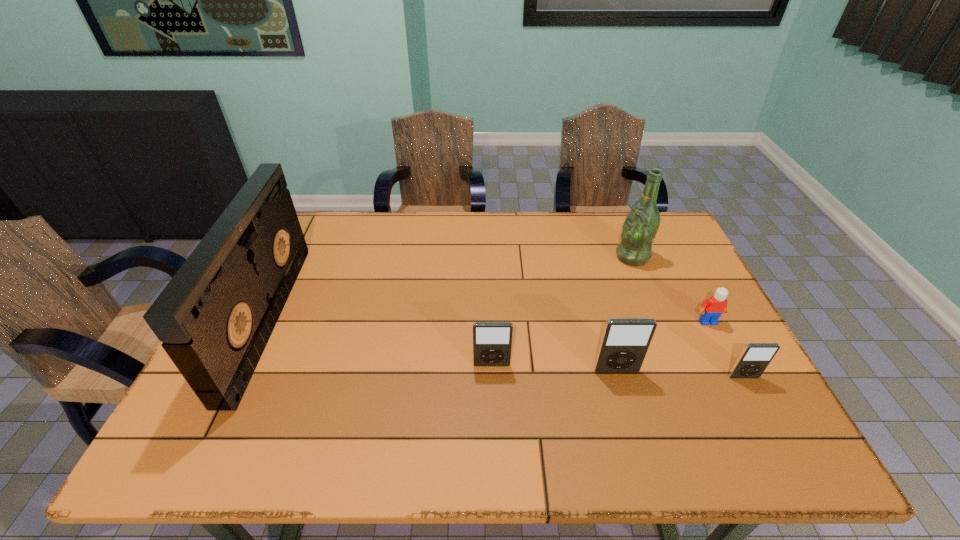
The width and height of the screenshot is (960, 540). I want to click on vacant place for an extra iPod on the left, so click(371, 359).